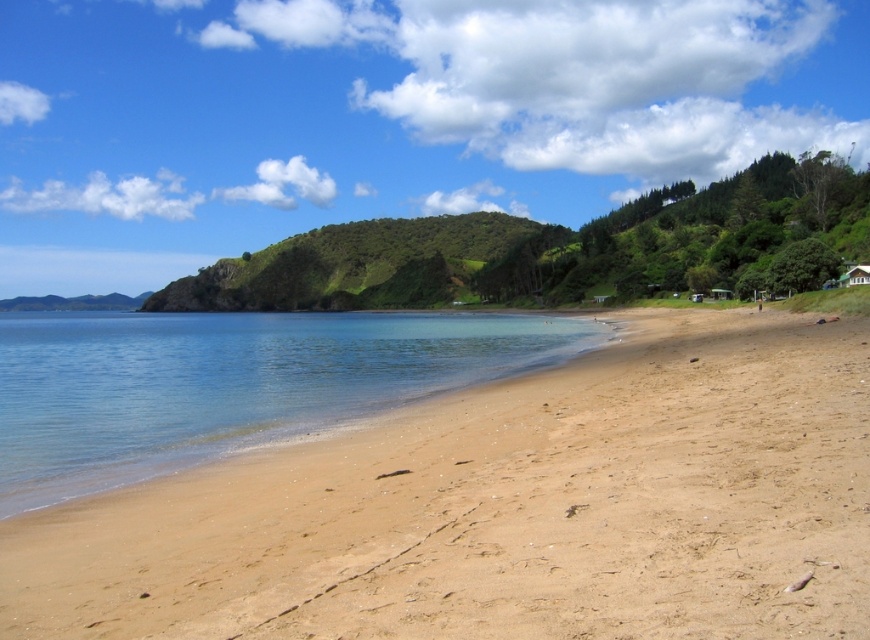
Question: Can you confirm if sandy beach at lower right is positioned to the left of clear blue water at center?

Choices:
 (A) yes
 (B) no

Answer: (B)

Question: Does sandy beach at lower right appear over clear blue water at center?

Choices:
 (A) no
 (B) yes

Answer: (A)

Question: Is sandy beach at lower right smaller than clear blue water at center?

Choices:
 (A) no
 (B) yes

Answer: (B)

Question: Which object is farther from the camera taking this photo?

Choices:
 (A) sandy beach at lower right
 (B) clear blue water at center

Answer: (B)